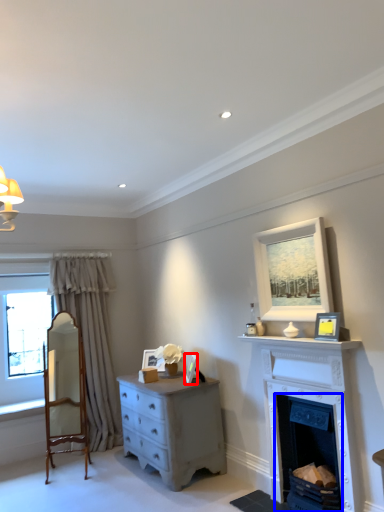
Question: Which object is further to the camera taking this photo, picture frame (highlighted by a red box) or fireplace (highlighted by a blue box)?

Choices:
 (A) picture frame
 (B) fireplace

Answer: (A)